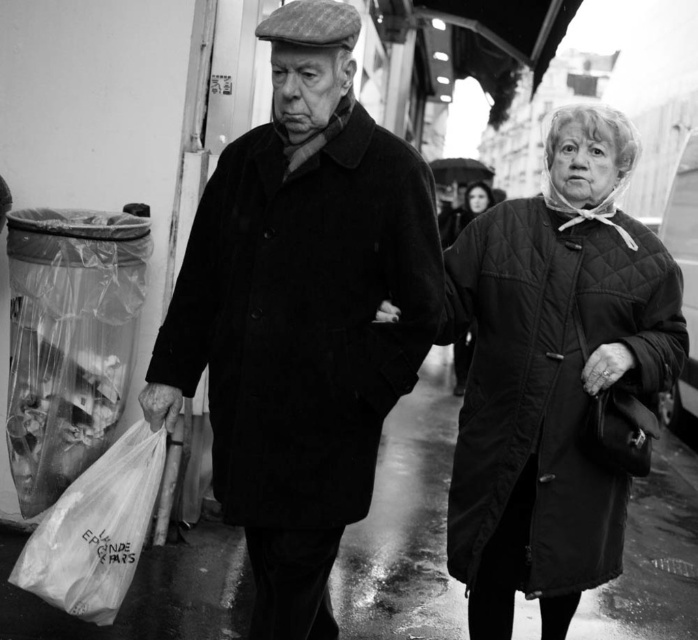
Which is in front, point (609, 276) or point (581, 600)?

Point (609, 276)

Identify the location of quilted black coat at right. The image size is (698, 640). (551, 374).

Where is `quilted black coat at center`? Image resolution: width=698 pixels, height=640 pixels. quilted black coat at center is located at coordinates (467, 209).

Who is more forward, (467, 344) or (461, 172)?

Point (467, 344) is in front.

Who is more distant from viewer, (456, 234) or (491, 170)?

The point (491, 170) is behind.

Where is `quilted black coat at center`? The image size is (698, 640). quilted black coat at center is located at coordinates (467, 209).

Can you confirm if matte black coat at center is positioned to the left of quilted black coat at center?

Correct, you'll find matte black coat at center to the left of quilted black coat at center.

What do you see at coordinates (302, 314) in the screenshot?
I see `matte black coat at center` at bounding box center [302, 314].

Between point (279, 150) and point (459, 358), which one is positioned behind?

The point (459, 358) is behind.

Locate an element on the screen. The height and width of the screenshot is (640, 698). matte black coat at center is located at coordinates (302, 314).